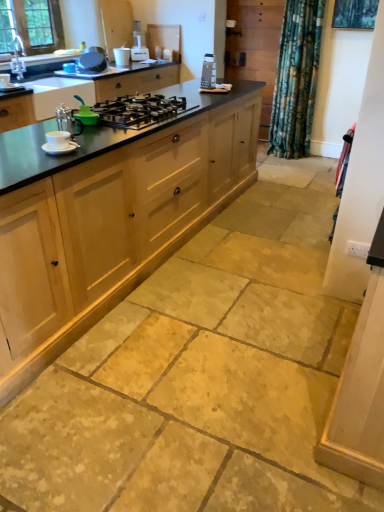
Question: From a real-world perspective, is matte silver sink at upper left positioned above or below black matte gas stove at center?

Choices:
 (A) above
 (B) below

Answer: (A)

Question: From the image's perspective, is matte silver sink at upper left positioned above or below black matte gas stove at center?

Choices:
 (A) below
 (B) above

Answer: (B)

Question: Based on their relative distances, which object is nearer to the metallic silver pot at upper center, which is counted as the 3th appliance, starting from the right?

Choices:
 (A) white plastic toaster at upper center
 (B) white glossy screen door at right
 (C) black polished countertop at left
 (D) natural wood cabinetry at center
 (E) green matte teapot at center-left, which is the second appliance in left-to-right order

Answer: (A)

Question: Which of these objects is positioned farthest from the metallic silver pot at upper center, which is the first appliance from back to front?

Choices:
 (A) black matte gas stove at center
 (B) matte silver sink at upper left
 (C) white plastic toaster at upper center
 (D) white glossy screen door at right
 (E) green matte teapot at center-left, which is the third appliance in top-to-bottom order

Answer: (D)